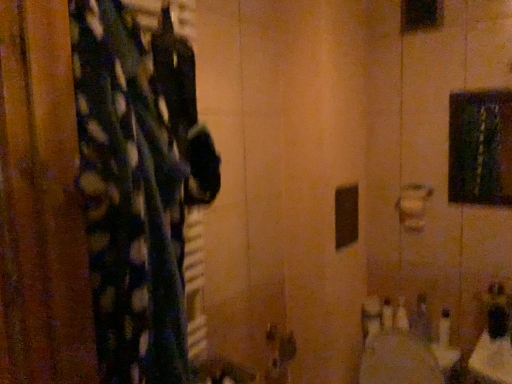
Question: Considering the relative positions of metallic silver soap at lower right, which appears as the 1th toiletry when viewed from the right, and white plastic bottles at lower right, marked as the 1th toiletry in a left-to-right arrangement, in the image provided, is metallic silver soap at lower right, which appears as the 1th toiletry when viewed from the right, to the left of white plastic bottles at lower right, marked as the 1th toiletry in a left-to-right arrangement, from the viewer's perspective?

Choices:
 (A) no
 (B) yes

Answer: (A)

Question: Is white plastic bottles at lower right, the second toiletry viewed from the right, located within metallic silver soap at lower right, the 2th toiletry positioned from the left?

Choices:
 (A) yes
 (B) no

Answer: (B)

Question: Is the position of metallic silver soap at lower right, which appears as the 1th toiletry when viewed from the right, more distant than that of white plastic bottles at lower right, the second toiletry viewed from the right?

Choices:
 (A) yes
 (B) no

Answer: (B)

Question: Is metallic silver soap at lower right, which appears as the 1th toiletry when viewed from the right, outside of white plastic bottles at lower right, marked as the 1th toiletry in a left-to-right arrangement?

Choices:
 (A) no
 (B) yes

Answer: (B)

Question: Does metallic silver soap at lower right, which appears as the 1th toiletry when viewed from the right, have a greater height compared to white plastic bottles at lower right, marked as the 1th toiletry in a left-to-right arrangement?

Choices:
 (A) yes
 (B) no

Answer: (A)

Question: From the image's perspective, is metallic silver soap at lower right, the 2th toiletry positioned from the left, above or below white plastic bottles at lower right, the second toiletry viewed from the right?

Choices:
 (A) above
 (B) below

Answer: (A)

Question: Looking at the image, does metallic silver soap at lower right, the 2th toiletry positioned from the left, seem bigger or smaller compared to white plastic bottles at lower right, marked as the 1th toiletry in a left-to-right arrangement?

Choices:
 (A) big
 (B) small

Answer: (A)

Question: From a real-world perspective, is metallic silver soap at lower right, which appears as the 1th toiletry when viewed from the right, physically located above or below white plastic bottles at lower right, the second toiletry viewed from the right?

Choices:
 (A) below
 (B) above

Answer: (B)

Question: Does point (418, 322) appear closer or farther from the camera than point (403, 311)?

Choices:
 (A) closer
 (B) farther

Answer: (A)

Question: Is point (104, 284) closer or farther from the camera than point (401, 309)?

Choices:
 (A) closer
 (B) farther

Answer: (A)

Question: In the image, is fluffy polka dot fabric at left positioned in front of or behind white plastic bottles at lower right, the second toiletry viewed from the right?

Choices:
 (A) behind
 (B) front

Answer: (B)

Question: Considering the positions of fluffy polka dot fabric at left and white plastic bottles at lower right, the second toiletry viewed from the right, in the image, is fluffy polka dot fabric at left bigger or smaller than white plastic bottles at lower right, the second toiletry viewed from the right,?

Choices:
 (A) small
 (B) big

Answer: (B)

Question: From the image's perspective, relative to white plastic bottles at lower right, marked as the 1th toiletry in a left-to-right arrangement, is fluffy polka dot fabric at left above or below?

Choices:
 (A) above
 (B) below

Answer: (A)

Question: Considering the relative positions of white plastic bottles at lower right, the second toiletry viewed from the right, and fluffy polka dot fabric at left in the image provided, is white plastic bottles at lower right, the second toiletry viewed from the right, to the left or to the right of fluffy polka dot fabric at left?

Choices:
 (A) right
 (B) left

Answer: (A)

Question: Looking at their shapes, would you say white plastic bottles at lower right, the second toiletry viewed from the right, is wider or thinner than fluffy polka dot fabric at left?

Choices:
 (A) thin
 (B) wide

Answer: (A)